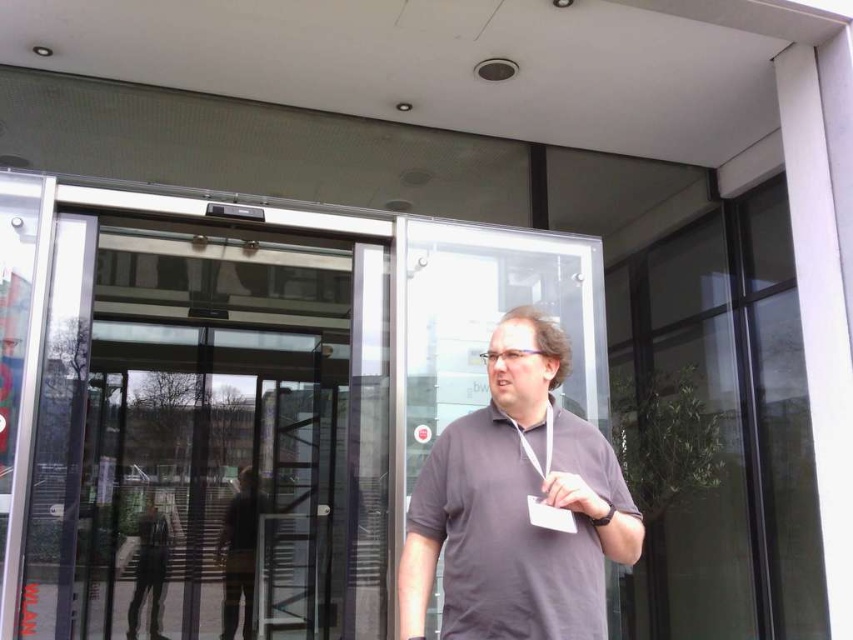
You are a delivery person holding a package that needs to be handed over to the man at the entrance. The package is 4 meters long. You want to place it on the ground between the transparent glass door at center and the matte gray wristwatch at center. Is there enough space to lay it down without bending or folding the package?

The transparent glass door at center and matte gray wristwatch at center are 3.73 meters apart from each other. Since the package is 4 meters long, which is longer than the available space between them, you cannot lay it down without bending or folding the package.

You are a delivery person standing at the entrance of the building. You need to place a package on the floor exactly 4 meters away from the transparent glass door at center. Can you place it near the camera? Explain your reasoning.

The transparent glass door at center and camera are 4.22 meters apart from each other. Since 4.22 meters is slightly more than 4 meters, placing the package near the camera would result in it being approximately 4.22 meters away from the transparent glass door at center, which is just beyond the desired 4 meters. Therefore, you should move slightly closer to the door to ensure the package is exactly 4 meters away.

You are a security guard at the building entrance. You need to check the badge on the lanyard around the man. Which object is closer to the ground, the gray matte shirt at center or the matte gray wristwatch at center?

The matte gray wristwatch at center is closer to the ground than the gray matte shirt at center.